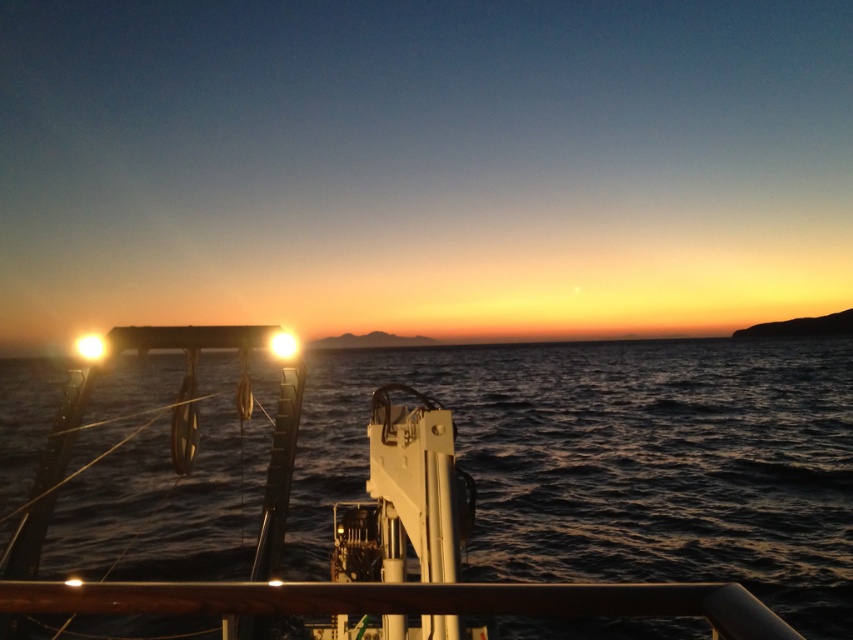
Question: Among these points, which one is farthest from the camera?

Choices:
 (A) (x=689, y=467)
 (B) (x=602, y=586)

Answer: (A)

Question: Does dark blue water at center appear over brown polished wood rail at lower center?

Choices:
 (A) no
 (B) yes

Answer: (A)

Question: Which of the following is the farthest from the observer?

Choices:
 (A) (581, 577)
 (B) (506, 609)

Answer: (A)

Question: Does dark blue water at center have a lesser width compared to brown polished wood rail at lower center?

Choices:
 (A) no
 (B) yes

Answer: (A)

Question: Is dark blue water at center behind brown polished wood rail at lower center?

Choices:
 (A) no
 (B) yes

Answer: (B)

Question: Which of the following is the closest to the observer?

Choices:
 (A) (459, 356)
 (B) (160, 612)

Answer: (B)